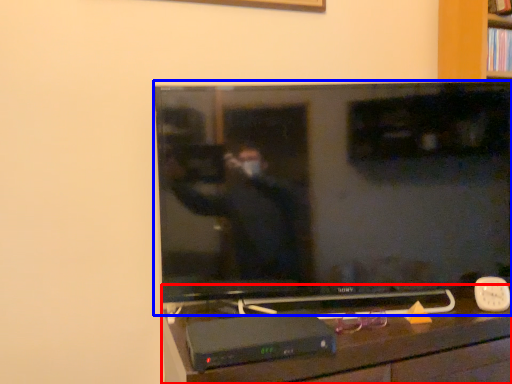
Question: Which point is closer to the camera, furniture (highlighted by a red box) or television (highlighted by a blue box)?

Choices:
 (A) furniture
 (B) television

Answer: (A)